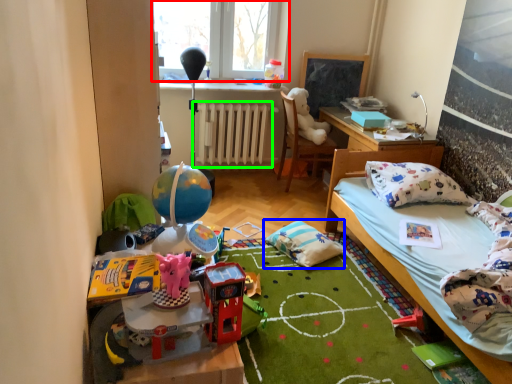
Question: Considering the real-world distances, which object is closest to window (highlighted by a red box)? pillow (highlighted by a blue box) or radiator (highlighted by a green box).

Choices:
 (A) pillow
 (B) radiator

Answer: (B)